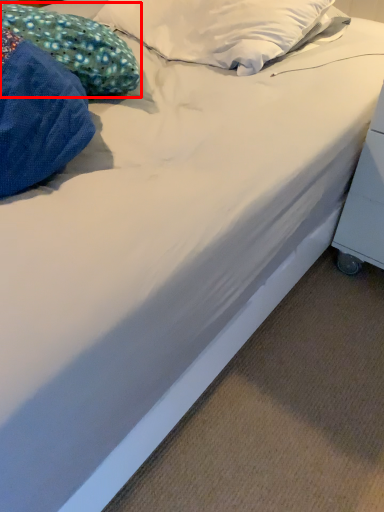
Question: From the image's perspective, where is pillow (annotated by the red box) located in relation to table in the image?

Choices:
 (A) above
 (B) below

Answer: (A)